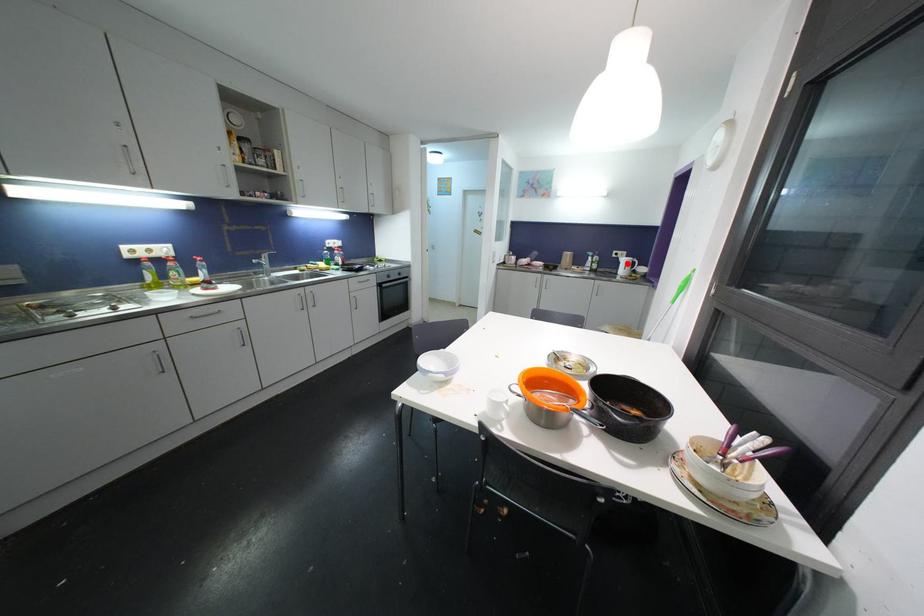
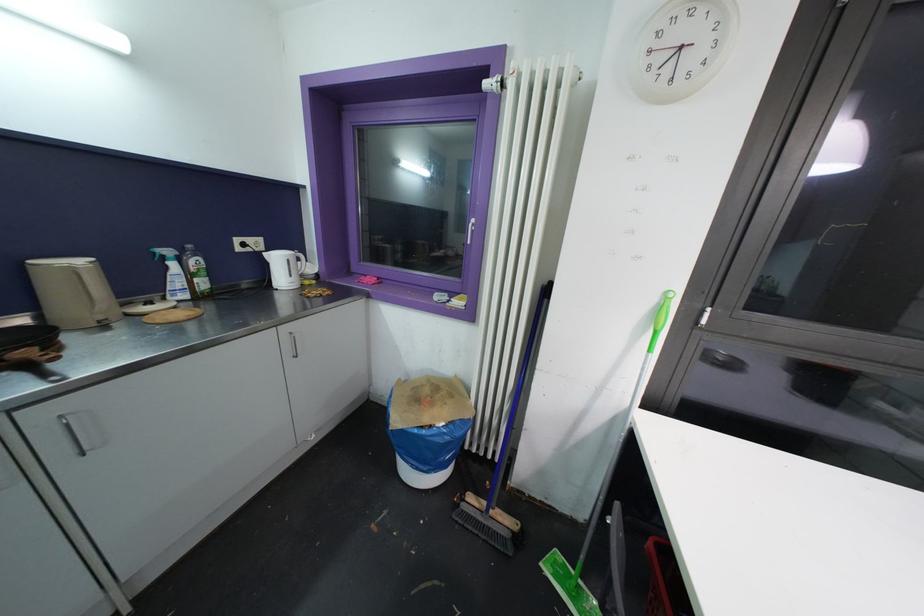
Locate, in the second image, the point that corresponds to the highlighted location in the first image.

(281, 262)